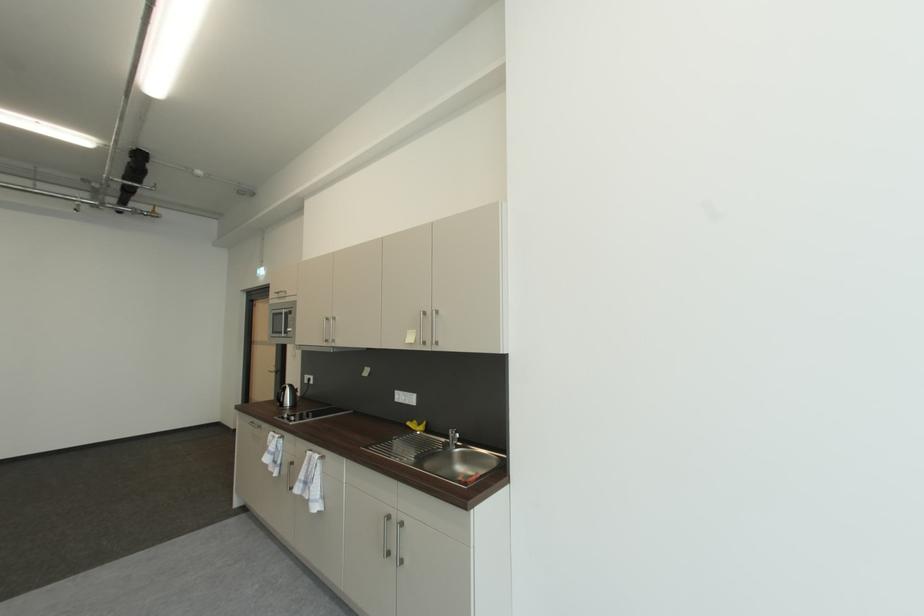
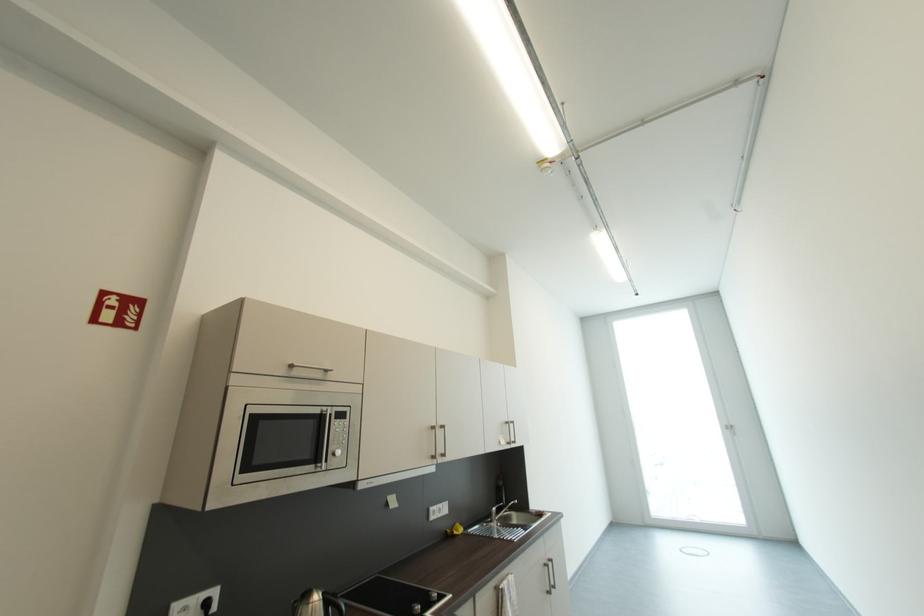
Find the pixel in the second image that matches (315,381) in the first image.

(213, 605)